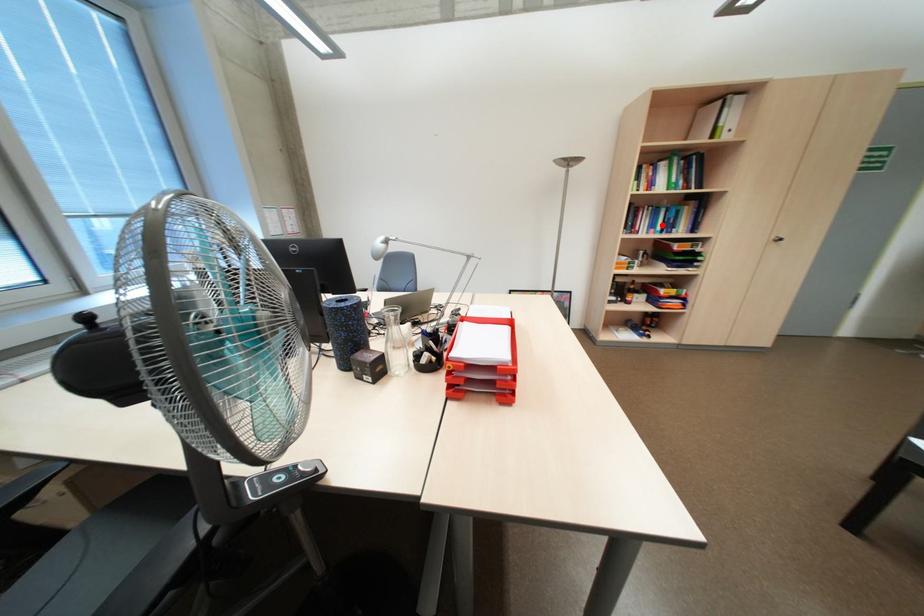
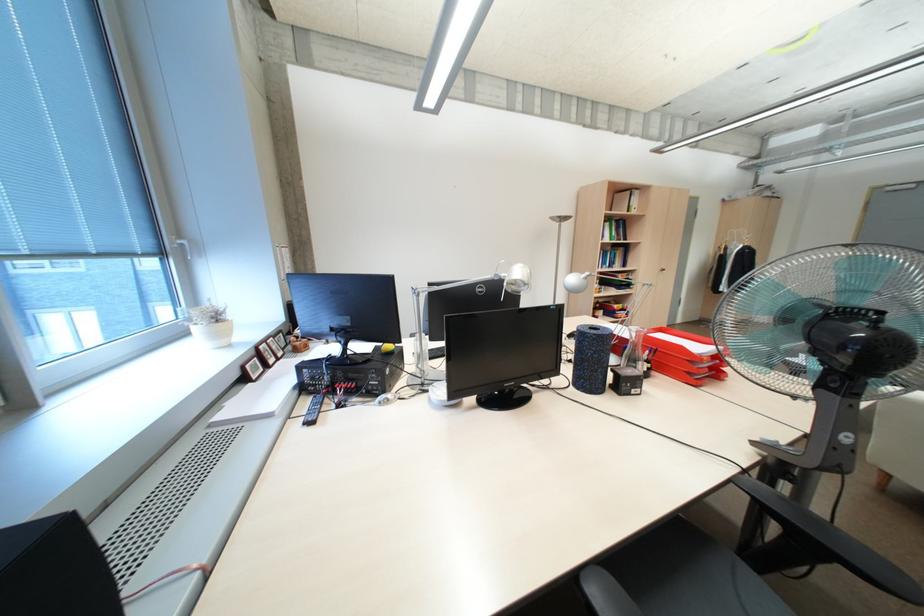
Question: I am providing you with two images of the same scene from different viewpoints. Given a red point in image1, look at the same physical point in image2. Is it:

Choices:
 (A) Closer to the viewpoint
 (B) Farther from the viewpoint

Answer: (B)